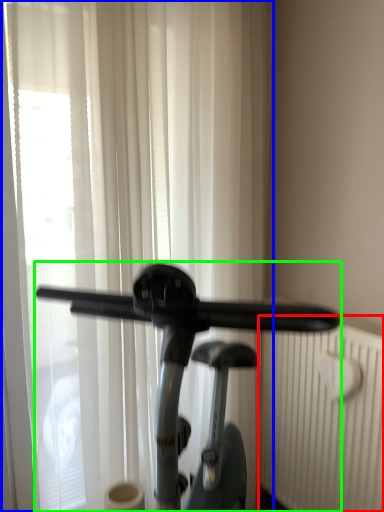
Question: Considering the real-world distances, which object is farthest from radiator (highlighted by a red box)? curtain (highlighted by a blue box) or stationary bicycle (highlighted by a green box)?

Choices:
 (A) curtain
 (B) stationary bicycle

Answer: (A)